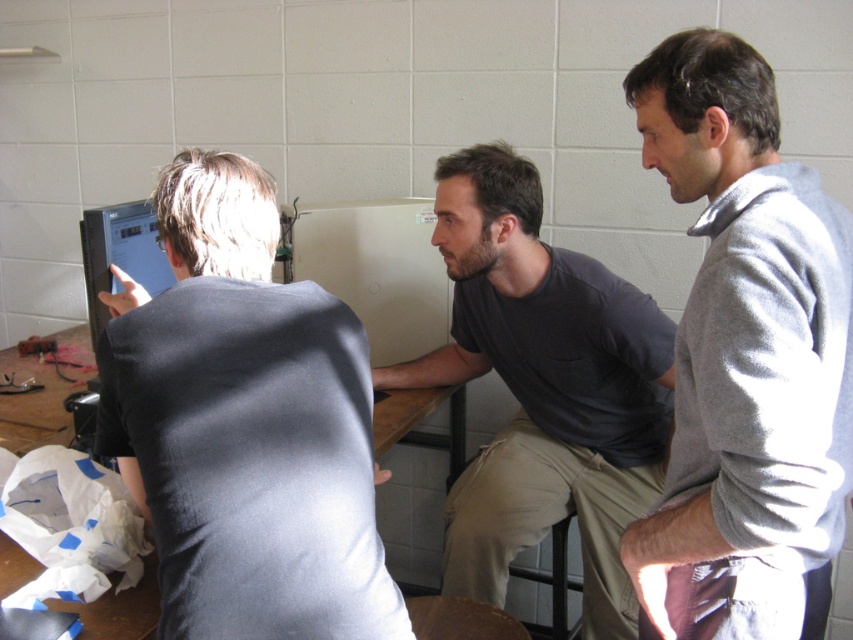
Describe the element at coordinates (244, 424) in the screenshot. This screenshot has width=853, height=640. I see `matte gray shirt at left` at that location.

Where is `matte gray shirt at left`? This screenshot has width=853, height=640. matte gray shirt at left is located at coordinates (244, 424).

Does gray sweater at upper right have a smaller size compared to dark gray shirt at center?

Yes.

Is gray sweater at upper right shorter than dark gray shirt at center?

Yes, gray sweater at upper right is shorter than dark gray shirt at center.

What do you see at coordinates (744, 355) in the screenshot? The width and height of the screenshot is (853, 640). I see `gray sweater at upper right` at bounding box center [744, 355].

The height and width of the screenshot is (640, 853). In order to click on gray sweater at upper right in this screenshot , I will do `click(744, 355)`.

Between matte gray shirt at left and gray sweater at upper right, which one has less height?

With less height is matte gray shirt at left.

Which is in front, point (103, 410) or point (737, 125)?

Point (737, 125) is in front.

Is point (314, 396) positioned before point (776, 612)?

No, it is behind (776, 612).

Locate an element on the screen. This screenshot has width=853, height=640. matte gray shirt at left is located at coordinates (244, 424).